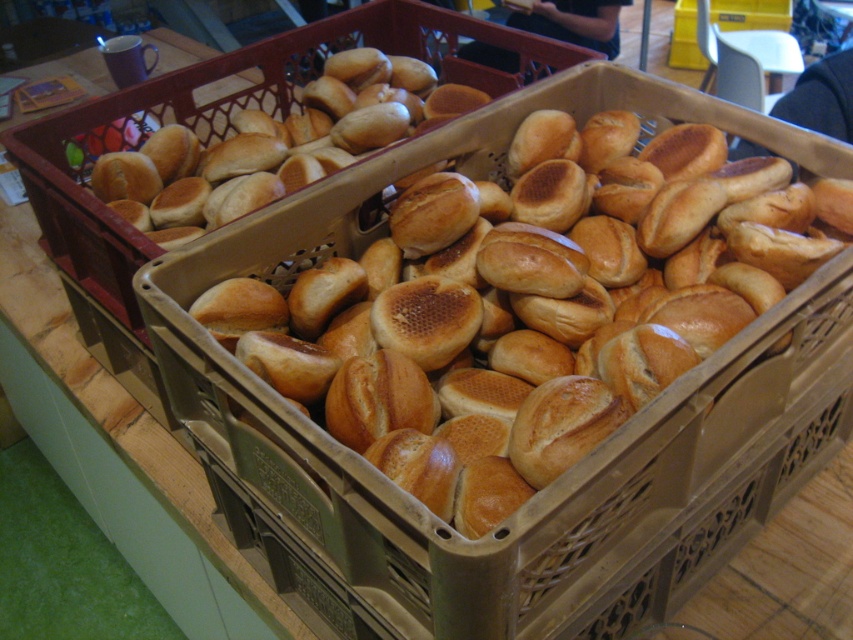
You are a baker who wants to place a new batch of bread on the table. You have two options on the table, the golden brown crusty bread at center and the golden brown plastic basket at center. Which one is closer to you so you can place the new bread next to it?

The golden brown crusty bread at center is closer to the viewer than the golden brown plastic basket at center, so you should place the new bread next to the golden brown crusty bread at center.

In the scene shown: You are a baker who needs to place a 16 inch long bread tray between the golden brown crusty bread at center and golden brown crusty bread at upper left. Can you fit it there?

The golden brown crusty bread at center and golden brown crusty bread at upper left are 15.33 inches apart from each other. Since the bread tray is 16 inches long, it cannot fit between them as the space is smaller than the tray.

You are a baker who needs to pack both the golden brown plastic basket at center and the golden brown crusty bread at upper left into a box. The box can only hold items where the smaller one fits entirely inside the larger one. Can you fit them this way?

The golden brown plastic basket at center is bigger than the golden brown crusty bread at upper left, so yes, the golden brown crusty bread at upper left can fit entirely inside the golden brown plastic basket at center.